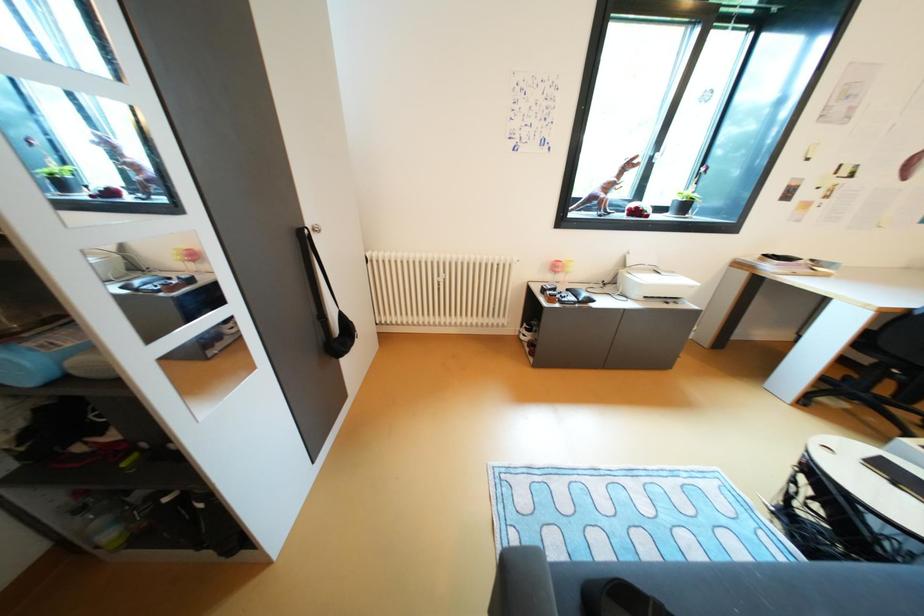
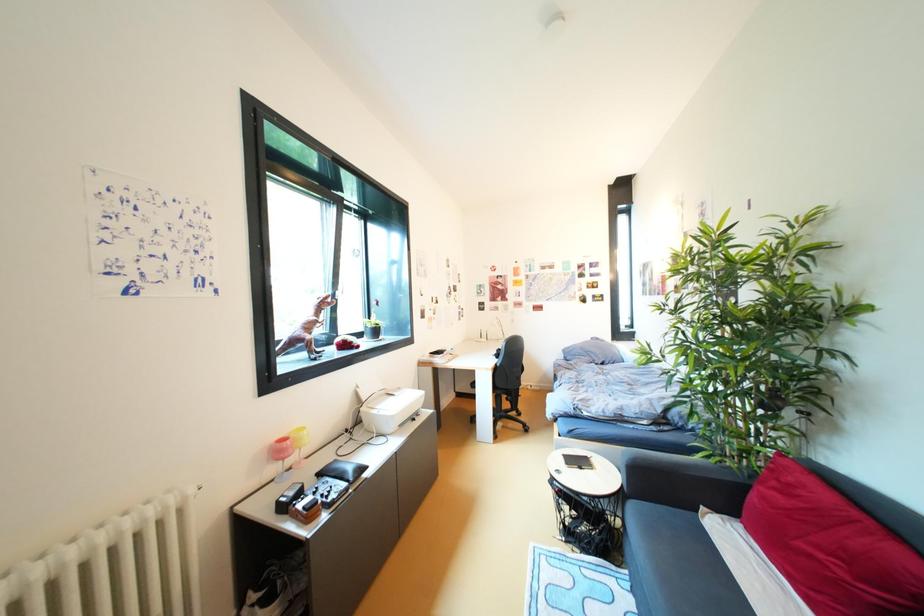
Question: The camera is either moving clockwise (left) or counter-clockwise (right) around the object. The first image is from the beginning of the video and the second image is from the end. Is the camera moving left or right when shooting the video?

Choices:
 (A) Left
 (B) Right

Answer: (A)